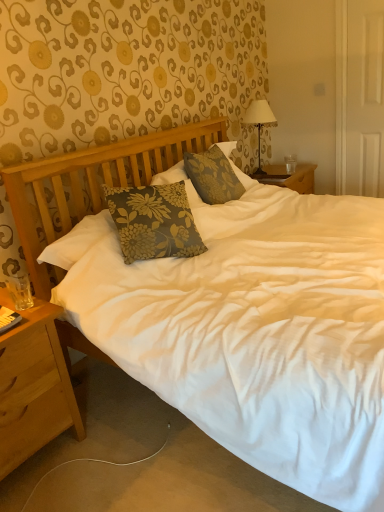
Question: Is light brown wood nightstand at lower left inside or outside of clear glass coffee cup at right?

Choices:
 (A) outside
 (B) inside

Answer: (A)

Question: Does point (34, 329) appear closer or farther from the camera than point (286, 159)?

Choices:
 (A) farther
 (B) closer

Answer: (B)

Question: Which of these objects is positioned farthest from the white fabric-covered lamp at upper right?

Choices:
 (A) light brown wood nightstand at lower left
 (B) floral fabric pillow at center
 (C) clear glass coffee cup at right

Answer: (A)

Question: Based on their relative distances, which object is farther from the clear glass coffee cup at right?

Choices:
 (A) floral fabric pillow at center
 (B) white fabric-covered lamp at upper right
 (C) light brown wood nightstand at lower left

Answer: (C)